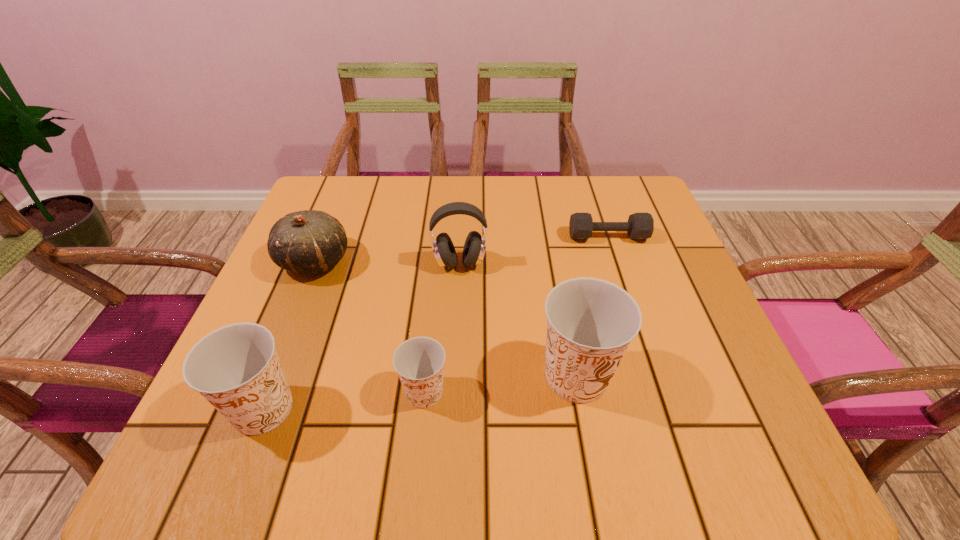
Where is `vacant point that satisfies the following two spatial constraints: 1. on the front side of the rightmost Dixie cup; 2. on the right side of the fourth tallest object`? The width and height of the screenshot is (960, 540). vacant point that satisfies the following two spatial constraints: 1. on the front side of the rightmost Dixie cup; 2. on the right side of the fourth tallest object is located at coordinates (268, 376).

Identify the location of vacant region that satisfies the following two spatial constraints: 1. on the back side of the dumbbell; 2. on the right side of the third shortest object. (324, 237).

I want to click on vacant space that satisfies the following two spatial constraints: 1. on the ear cups of the rightmost Dixie cup; 2. on the right side of the headset, so click(454, 376).